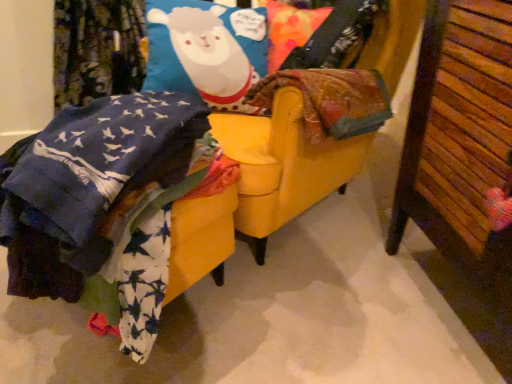
Question: From a real-world perspective, is yellow fabric swivel chair at center physically located above or below wooden slats at right?

Choices:
 (A) below
 (B) above

Answer: (A)

Question: From the image's perspective, is yellow fabric swivel chair at center above or below wooden slats at right?

Choices:
 (A) below
 (B) above

Answer: (B)

Question: In the image, is yellow fabric swivel chair at center positioned in front of or behind wooden slats at right?

Choices:
 (A) behind
 (B) front

Answer: (A)

Question: In terms of size, does wooden slats at right appear bigger or smaller than yellow fabric swivel chair at center?

Choices:
 (A) big
 (B) small

Answer: (B)

Question: Does point (450, 89) appear closer or farther from the camera than point (286, 144)?

Choices:
 (A) farther
 (B) closer

Answer: (B)

Question: In the image, is wooden slats at right on the left side or the right side of yellow fabric swivel chair at center?

Choices:
 (A) right
 (B) left

Answer: (A)

Question: Choose the correct answer: Is wooden slats at right inside yellow fabric swivel chair at center or outside it?

Choices:
 (A) outside
 (B) inside

Answer: (A)